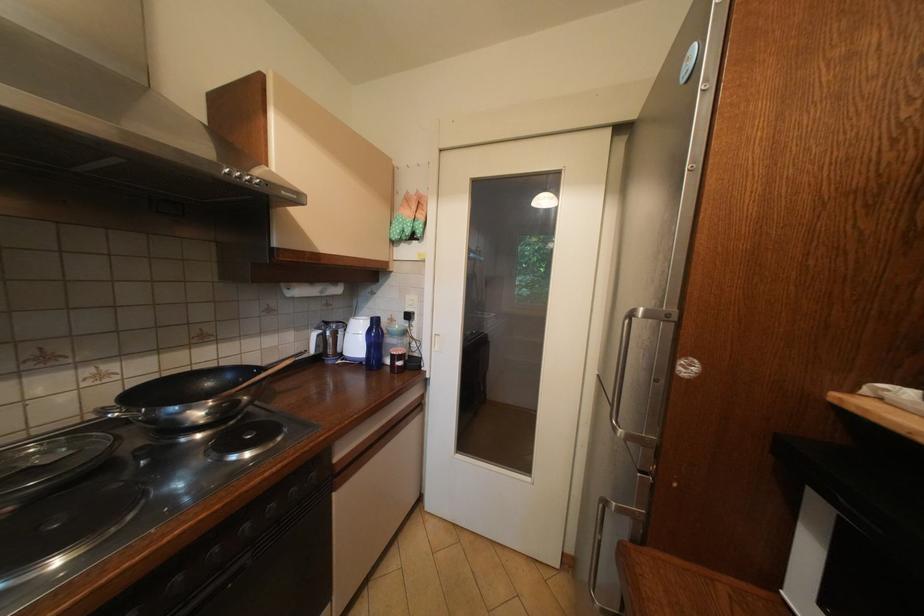
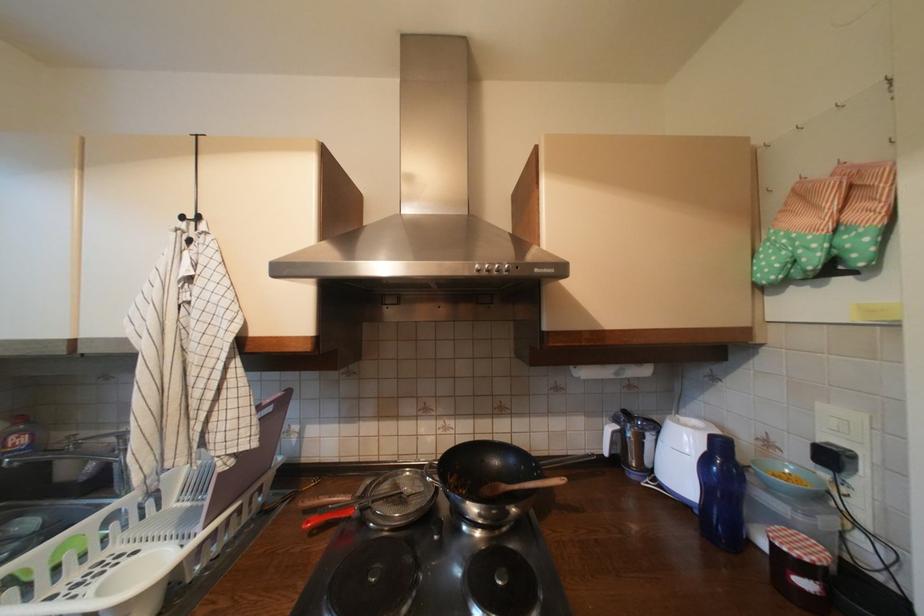
Locate, in the second image, the point that corresponds to the point at 371,363 in the first image.

(704, 513)